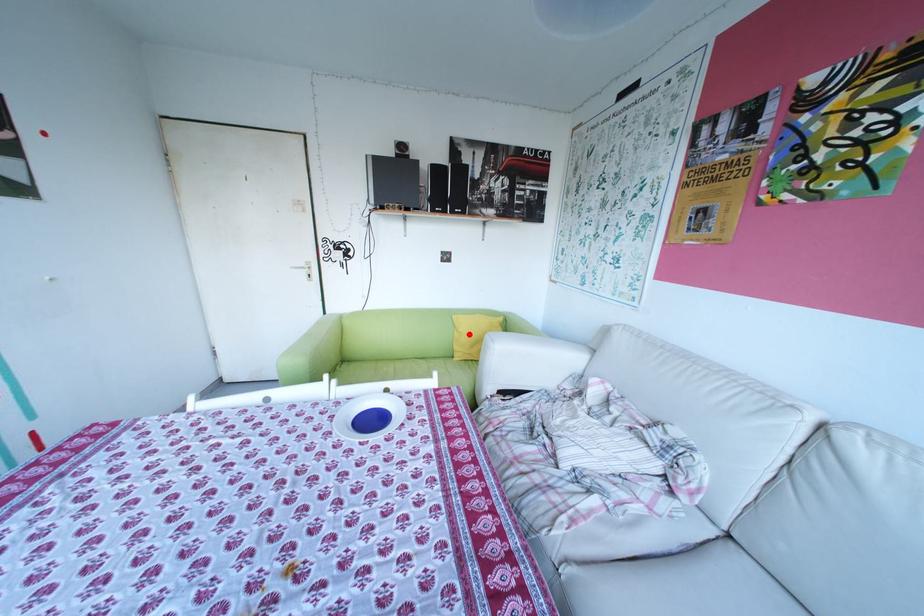
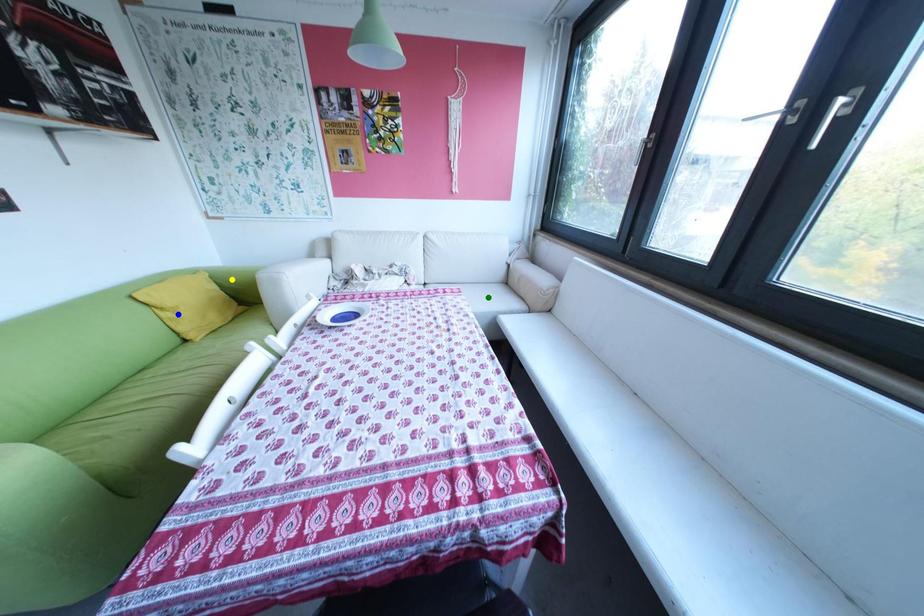
Question: I am providing you with two images of the same scene from different viewpoints. A red point is marked on the first image. You are given multiple points on the second image. Which point in image 2 is actually the same real-world point as the red point in image 1?

Choices:
 (A) blue point
 (B) green point
 (C) yellow point

Answer: (A)